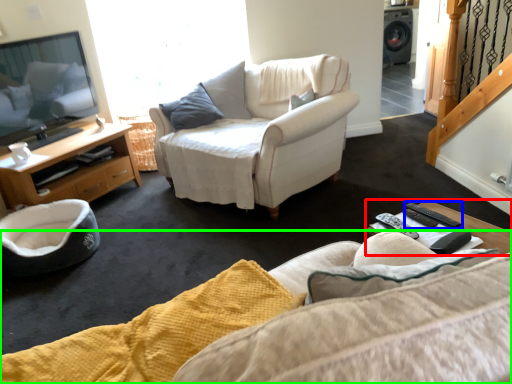
Question: Which object is the closest to the coffee table (highlighted by a red box)? Choose among these: remote (highlighted by a blue box) or studio couch (highlighted by a green box).

Choices:
 (A) remote
 (B) studio couch

Answer: (A)